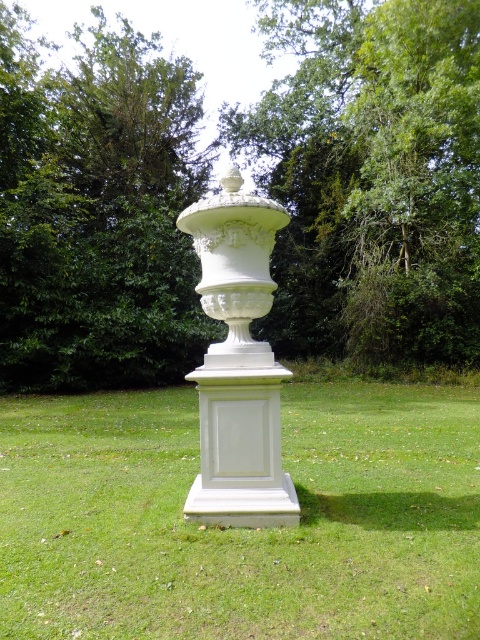
You are standing in a garden and see a classical white urn on a pedestal. There is a point marked at coordinates (372, 179) in the image. Based on the scene description, can you determine what object or feature this point is located on?

The point at coordinates (372, 179) is located on the green leafy tree at center.

You are standing in front of the classical white urn on the pedestal. Looking at the green leafy tree at center, can you determine its exact position relative to the urn?

The green leafy tree at center is located at point coordinates of 0.280 on the x axis and 0.775 on the y axis relative to the urn.

You are standing in front of the classical white urn on the pedestal. Looking around, you notice a point marked at coordinates (372, 179). What object is located at this coordinate?

The point at coordinates (372, 179) corresponds to the green leafy tree at center.